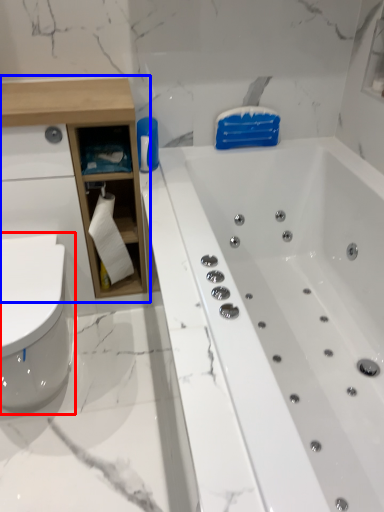
Question: Which object is further to the camera taking this photo, toilet (highlighted by a red box) or cabinetry (highlighted by a blue box)?

Choices:
 (A) toilet
 (B) cabinetry

Answer: (B)